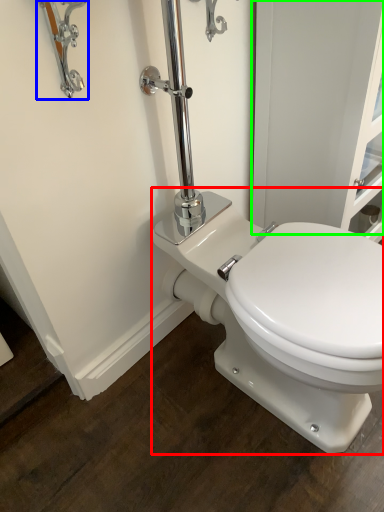
Question: Based on their relative distances, which object is nearer to toilet (highlighted by a red box)? Choose from faucet (highlighted by a blue box) and screen door (highlighted by a green box).

Choices:
 (A) faucet
 (B) screen door

Answer: (B)